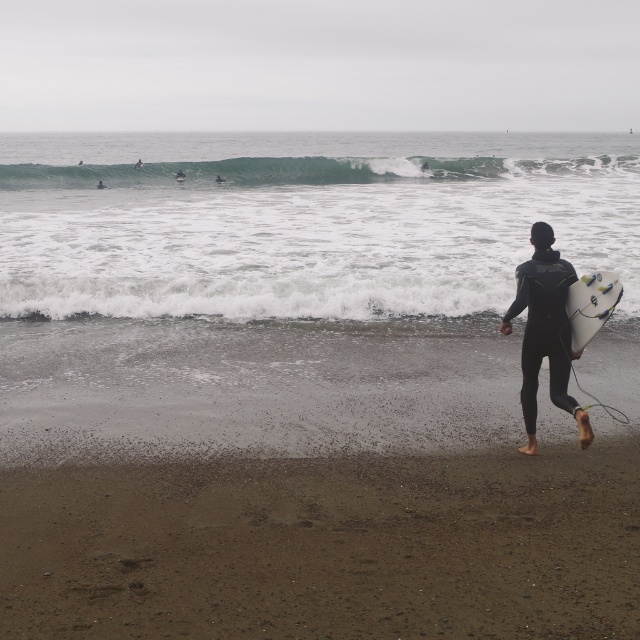
Question: Which point is closer to the camera?

Choices:
 (A) dark sand at lower center
 (B) white foamy water at center

Answer: (A)

Question: Can you confirm if dark sand at lower center is smaller than green rubber wave at upper center?

Choices:
 (A) no
 (B) yes

Answer: (B)

Question: Considering the relative positions of black matte wetsuit at center and white glossy surfboard at right in the image provided, where is black matte wetsuit at center located with respect to white glossy surfboard at right?

Choices:
 (A) above
 (B) below

Answer: (B)

Question: Which of the following is the farthest from the observer?

Choices:
 (A) click(595, 288)
 (B) click(212, 173)

Answer: (B)

Question: Which point is farther to the camera?

Choices:
 (A) black matte wetsuit at center
 (B) white glossy surfboard at right
 (C) green rubber wave at upper center
 (D) dark sand at lower center

Answer: (C)

Question: Is dark sand at lower center positioned before white foamy water at center?

Choices:
 (A) yes
 (B) no

Answer: (A)